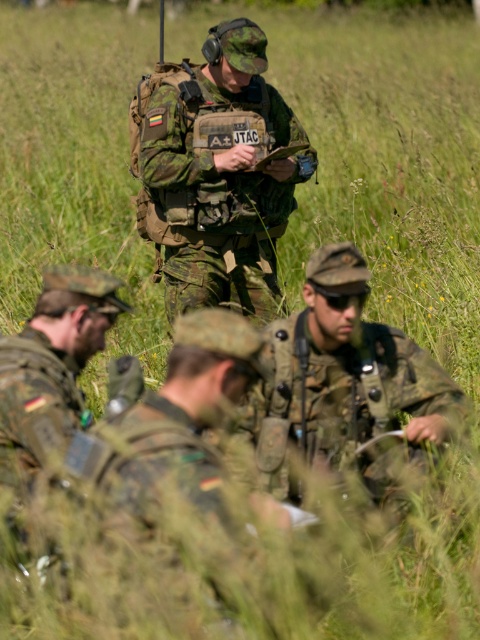
Can you confirm if camouflage uniform at center is positioned above camouflage uniform at lower left?

No, camouflage uniform at center is not above camouflage uniform at lower left.

The width and height of the screenshot is (480, 640). What do you see at coordinates (342, 378) in the screenshot?
I see `camouflage uniform at center` at bounding box center [342, 378].

The width and height of the screenshot is (480, 640). What do you see at coordinates (342, 378) in the screenshot?
I see `camouflage uniform at center` at bounding box center [342, 378].

You are a GUI agent. You are given a task and a screenshot of the screen. Output one action in this format:
    pyautogui.click(x=<x>, y=<y>)
    Task: Click on the camouflage uniform at center
    The image size is (480, 640).
    Given the screenshot: What is the action you would take?
    pyautogui.click(x=342, y=378)

Does camouflage fabric uniform at center have a larger size compared to camouflage uniform at lower left?

Yes.

How much distance is there between camouflage fabric uniform at center and camouflage uniform at lower left?

camouflage fabric uniform at center and camouflage uniform at lower left are 1.92 meters apart from each other.

Which is in front, point (272, 216) or point (0, 368)?

Point (0, 368)

This screenshot has height=640, width=480. In order to click on camouflage fabric uniform at center in this screenshot , I will do `click(218, 173)`.

Is camouflage fabric uniform at center above camouflage uniform at center?

Correct, camouflage fabric uniform at center is located above camouflage uniform at center.

Between camouflage fabric uniform at center and camouflage uniform at center, which one appears on the right side from the viewer's perspective?

camouflage uniform at center is more to the right.

Describe the element at coordinates (218, 173) in the screenshot. I see `camouflage fabric uniform at center` at that location.

At what (x,y) coordinates should I click in order to perform the action: click on camouflage fabric uniform at center. Please return your answer as a coordinate pair (x, y). The height and width of the screenshot is (640, 480). Looking at the image, I should click on (218, 173).